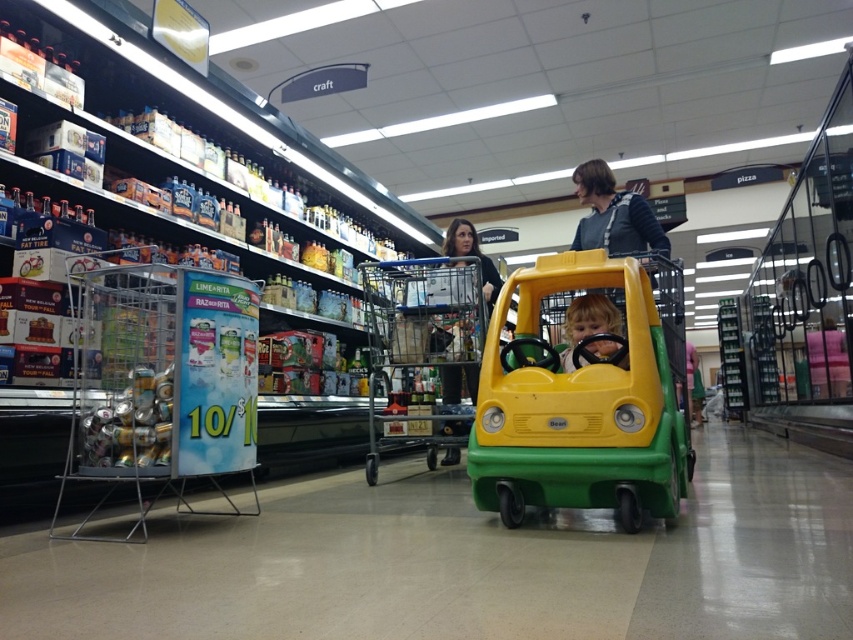
You are standing in the grocery store aisle and want to pick up two items located at point (614, 348) and point (370, 278). Which item will you reach first if you move directly toward them?

You will reach the item at point (614, 348) first because it is closer to you than the item at point (370, 278).

You are standing in the grocery store aisle and want to take a photo of both the refrigerated section and the promotional sign. Which point, point (553, 470) or point (473, 228), should you focus on first to ensure both are in clear view?

Point (553, 470) is closer to the camera than point (473, 228). To ensure both are in clear view, focus on the closer point first.

You are standing in the grocery store aisle and see a point marked at coordinates (584, 392). According to the image, what object is this point located on?

The point at coordinates (584, 392) is located on the green plastic toy car at center.